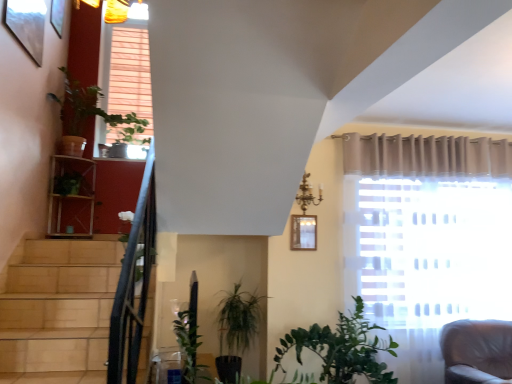
What do you see at coordinates (126, 126) in the screenshot?
I see `green leafy plant at upper left` at bounding box center [126, 126].

In order to face green leafy plant at upper left, should I rotate leftwards or rightwards?

Turn left by 17.169 degrees to look at green leafy plant at upper left.

Locate an element on the screen. This screenshot has height=384, width=512. green leafy plant at upper left is located at coordinates (126, 126).

Describe the element at coordinates (303, 232) in the screenshot. I see `wooden picture frame at upper center` at that location.

I want to click on wooden picture frame at upper center, so click(x=303, y=232).

Locate an element on the screen. The width and height of the screenshot is (512, 384). green leafy plant at upper left is located at coordinates (126, 126).

In the image, is green leafy plant at upper left on the left side or the right side of wooden picture frame at upper center?

Clearly, green leafy plant at upper left is on the left of wooden picture frame at upper center in the image.

Does green leafy plant at upper left lie in front of wooden picture frame at upper center?

No, it is behind wooden picture frame at upper center.

Is point (143, 141) closer to camera compared to point (303, 220)?

No, (143, 141) is further to viewer.

Looking at this image, from the image's perspective, is green leafy plant at upper left above or below wooden picture frame at upper center?

Clearly, from the image's perspective, green leafy plant at upper left is above wooden picture frame at upper center.

From a real-world perspective, which is physically below, green leafy plant at upper left or wooden picture frame at upper center?

wooden picture frame at upper center, from a real-world perspective.

Which of these two, green leafy plant at upper left or wooden picture frame at upper center, is thinner?

Thinner between the two is wooden picture frame at upper center.

Is green leafy plant at upper left taller than wooden picture frame at upper center?

Yes.

Who is bigger, green leafy plant at upper left or wooden picture frame at upper center?

Bigger between the two is green leafy plant at upper left.

Is green leafy plant at upper left not within wooden picture frame at upper center?

Yes, green leafy plant at upper left is located beyond the bounds of wooden picture frame at upper center.

Is green leafy plant at upper left with wooden picture frame at upper center?

There is a gap between green leafy plant at upper left and wooden picture frame at upper center.

Is green leafy plant at upper left oriented towards wooden picture frame at upper center?

No, green leafy plant at upper left does not turn towards wooden picture frame at upper center.

How many degrees apart are the facing directions of green leafy plant at upper left and wooden picture frame at upper center?

The angular difference between green leafy plant at upper left and wooden picture frame at upper center is 0.338 degrees.

How much distance is there between green leafy plant at upper left and wooden picture frame at upper center?

green leafy plant at upper left is 1.86 meters away from wooden picture frame at upper center.

Where is `plant on the left of wooden picture frame at upper center`? plant on the left of wooden picture frame at upper center is located at coordinates 126,126.

Between wooden picture frame at upper center and green leafy plant at upper left, which one appears on the right side from the viewer's perspective?

Positioned to the right is wooden picture frame at upper center.

Which object is further away from the camera taking this photo, wooden picture frame at upper center or green leafy plant at upper left?

green leafy plant at upper left is further from the camera.

Is point (295, 248) closer to viewer compared to point (121, 137)?

That is True.

From the image's perspective, is wooden picture frame at upper center beneath green leafy plant at upper left?

Indeed, from the image's perspective, wooden picture frame at upper center is shown beneath green leafy plant at upper left.

From a real-world perspective, is wooden picture frame at upper center above or below green leafy plant at upper left?

In terms of real-world spatial position, wooden picture frame at upper center is below green leafy plant at upper left.

Considering the relative sizes of wooden picture frame at upper center and green leafy plant at upper left in the image provided, is wooden picture frame at upper center wider than green leafy plant at upper left?

No, wooden picture frame at upper center is not wider than green leafy plant at upper left.

Between wooden picture frame at upper center and green leafy plant at upper left, which one has more height?

green leafy plant at upper left.

Between wooden picture frame at upper center and green leafy plant at upper left, which one has smaller size?

wooden picture frame at upper center is smaller.

Is green leafy plant at upper left a part of wooden picture frame at upper center?

That's incorrect, green leafy plant at upper left is not inside wooden picture frame at upper center.

Is wooden picture frame at upper center with green leafy plant at upper left?

wooden picture frame at upper center is not next to green leafy plant at upper left, and they're not touching.

Is wooden picture frame at upper center oriented away from green leafy plant at upper left?

No, wooden picture frame at upper center is not facing the opposite direction of green leafy plant at upper left.

How different are the orientations of wooden picture frame at upper center and green leafy plant at upper left in degrees?

The angle between the facing direction of wooden picture frame at upper center and the facing direction of green leafy plant at upper left is 0.338 degrees.

Measure the distance from wooden picture frame at upper center to green leafy plant at upper left.

wooden picture frame at upper center and green leafy plant at upper left are 6.10 feet apart from each other.

The width and height of the screenshot is (512, 384). Identify the location of picture frame in front of the green leafy plant at upper left. (303, 232).

At what (x,y) coordinates should I click in order to perform the action: click on plant above the wooden picture frame at upper center (from the image's perspective). Please return your answer as a coordinate pair (x, y). The height and width of the screenshot is (384, 512). Looking at the image, I should click on (126, 126).

At what (x,y) coordinates should I click in order to perform the action: click on picture frame in front of the green leafy plant at upper left. Please return your answer as a coordinate pair (x, y). This screenshot has width=512, height=384. Looking at the image, I should click on (303, 232).